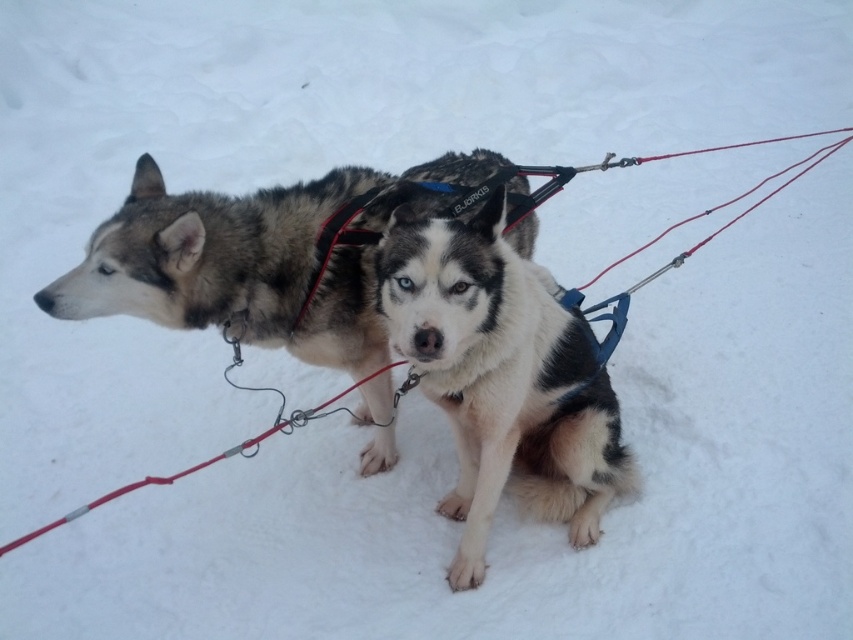
You are a photographer standing at the camera position. You want to take a photo of the white fur dog at center. If your camera has a maximum focus range of 2 meters, will you be able to capture the dog clearly?

The white fur dog at center and camera are 2.11 meters apart from each other. Since the distance exceeds the camera maximum focus range of 2 meters, the photographer cannot capture the dog clearly.

You are a dog trainer who needs to secure both the white fur dog at center and the fluffy fur husky at center with a single long leash. The leash you have is 24 inches long. Can the leash accommodate both dogs without any adjustments?

The distance between the white fur dog at center and the fluffy fur husky at center is 22.56 inches. Since the leash is 24 inches long, it can accommodate both dogs without any adjustments as the leash is longer than the distance between them.

You are a photographer standing at the origin point of the coordinate system. You want to take a photo of the white fur dog at center. What are the coordinates where you should aim your camera to capture the dog perfectly?

The coordinates to aim your camera are at point [502,376] to capture the white fur dog at center.